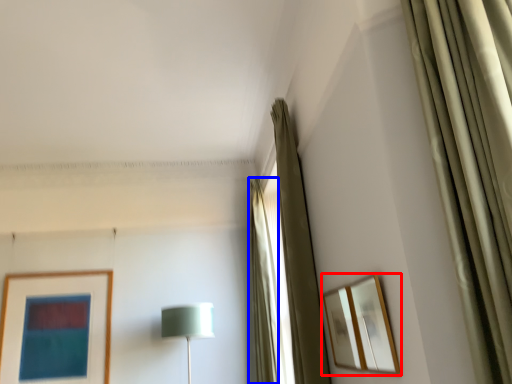
Question: Which point is closer to the camera, picture frame (highlighted by a red box) or curtain (highlighted by a blue box)?

Choices:
 (A) picture frame
 (B) curtain

Answer: (A)